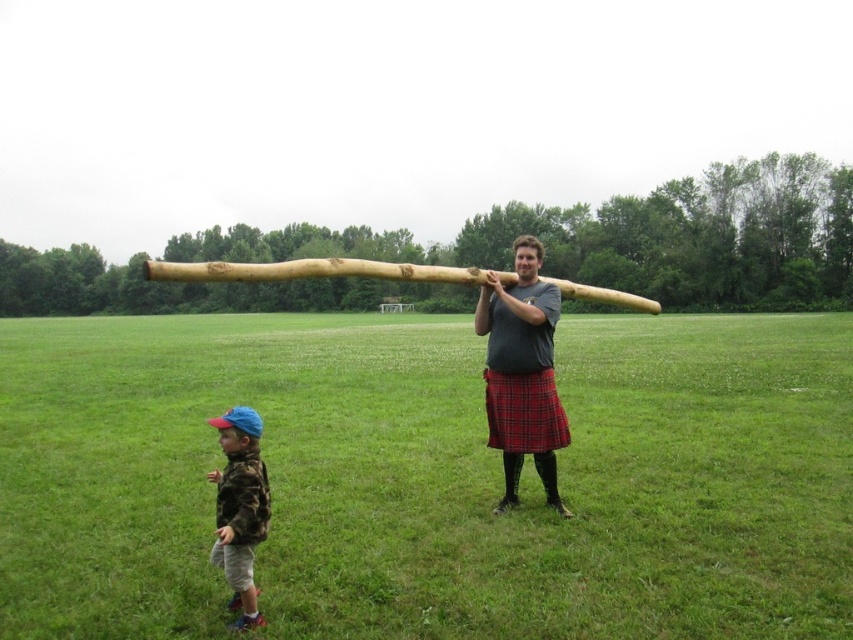
Can you confirm if green grass at center is taller than camo fabric shirt at lower left?

Yes, green grass at center is taller than camo fabric shirt at lower left.

Between green grass at center and camo fabric shirt at lower left, which one has more height?

Standing taller between the two is green grass at center.

At what (x,y) coordinates should I click in order to perform the action: click on green grass at center. Please return your answer as a coordinate pair (x, y). Looking at the image, I should click on (428, 477).

Describe the element at coordinates (428, 477) in the screenshot. I see `green grass at center` at that location.

Is green grass at center shorter than red plaid kilt at center?

In fact, green grass at center may be taller than red plaid kilt at center.

This screenshot has height=640, width=853. In order to click on green grass at center in this screenshot , I will do `click(428, 477)`.

I want to click on green grass at center, so click(x=428, y=477).

Which is behind, point (537, 346) or point (500, 396)?

Point (500, 396)

Can you confirm if matte wooden pole at center is bigger than red plaid kilt at center?

Correct, matte wooden pole at center is larger in size than red plaid kilt at center.

Find the location of a particular element. matte wooden pole at center is located at coordinates (521, 372).